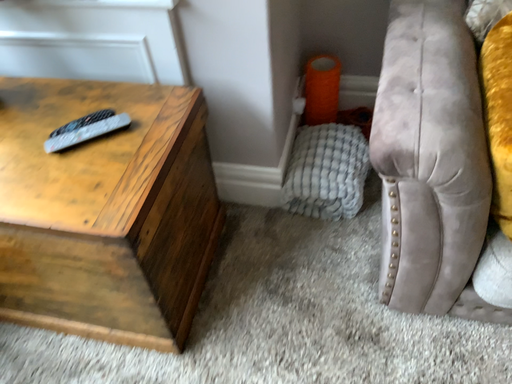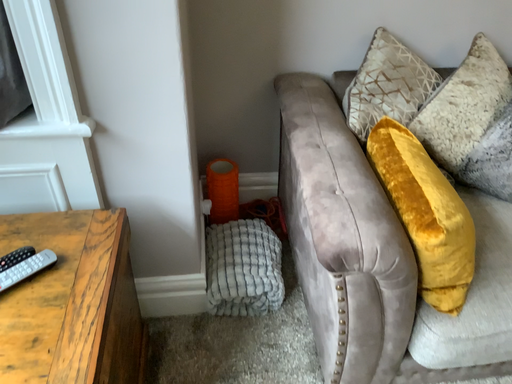
Question: How did the camera likely rotate when shooting the video?

Choices:
 (A) rotated right
 (B) rotated left

Answer: (A)